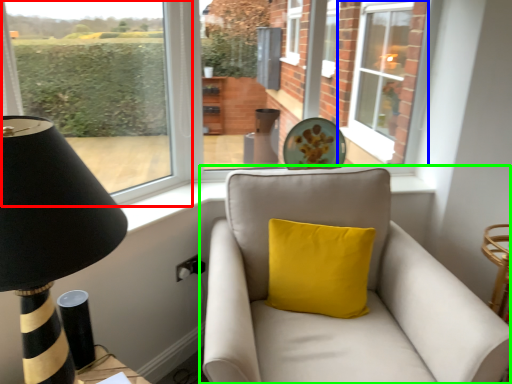
Question: Which object is the farthest from window (highlighted by a red box)? Choose among these: window (highlighted by a blue box) or studio couch (highlighted by a green box).

Choices:
 (A) window
 (B) studio couch

Answer: (A)